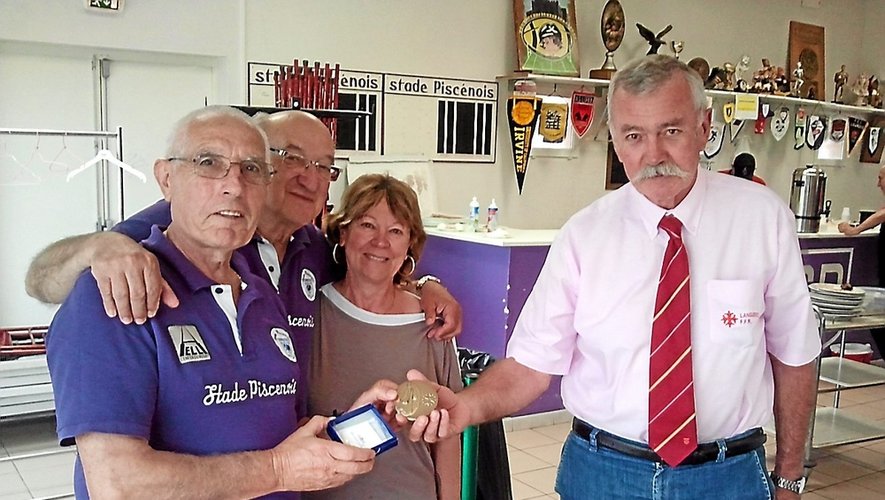
This screenshot has width=885, height=500. In order to click on football trophy in this screenshot , I will do `click(609, 27)`.